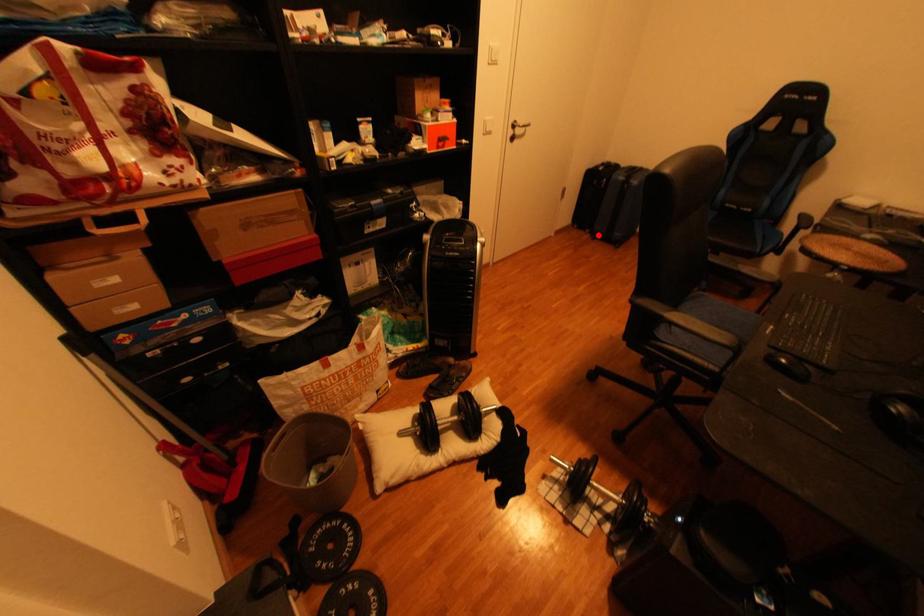
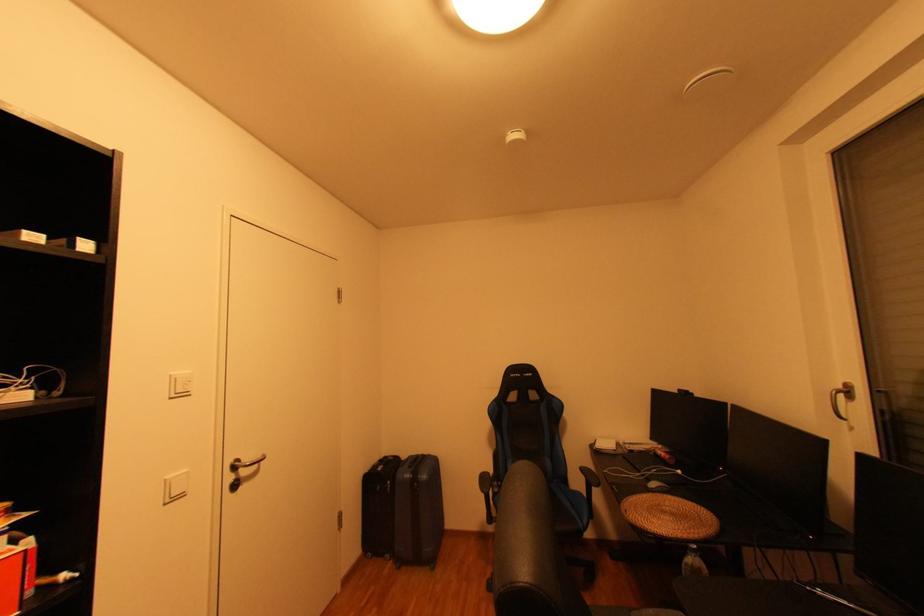
Question: I am providing you with two images of the same scene from different viewpoints. A red point is shown in image1. For the corresponding object point in image2, is it positioned nearer or farther from the camera?

Choices:
 (A) Nearer
 (B) Farther

Answer: (B)